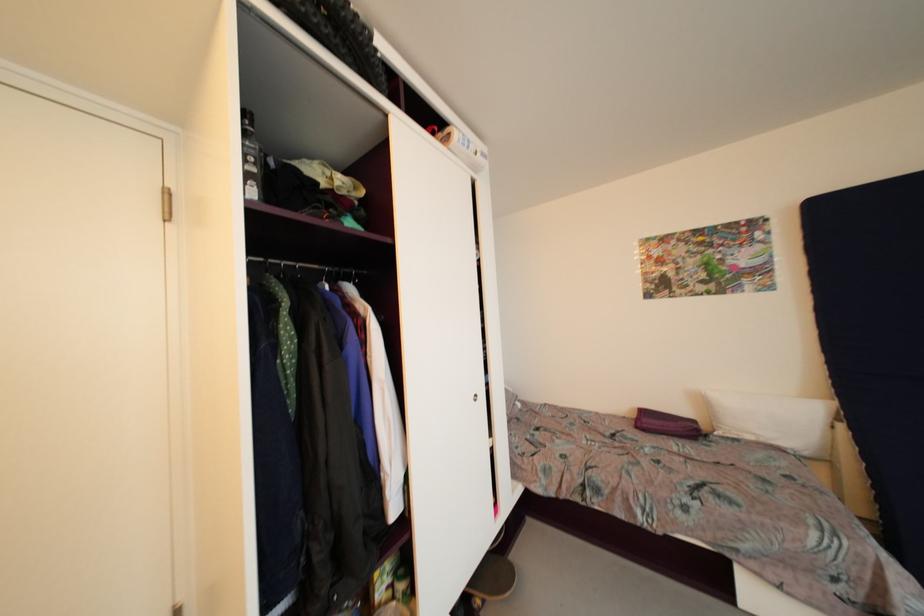
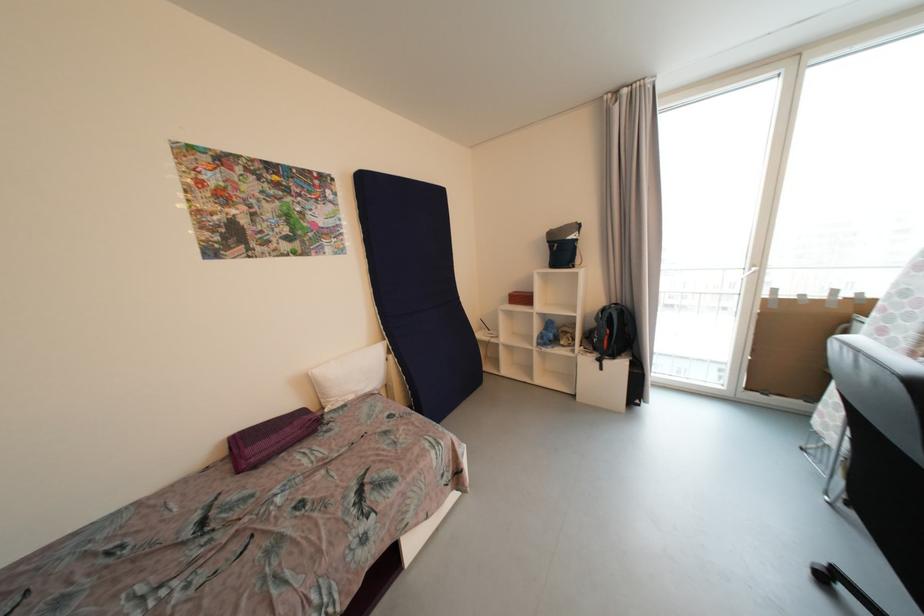
Locate, in the second image, the point that corresponds to the point at 847,428 in the first image.

(396, 359)